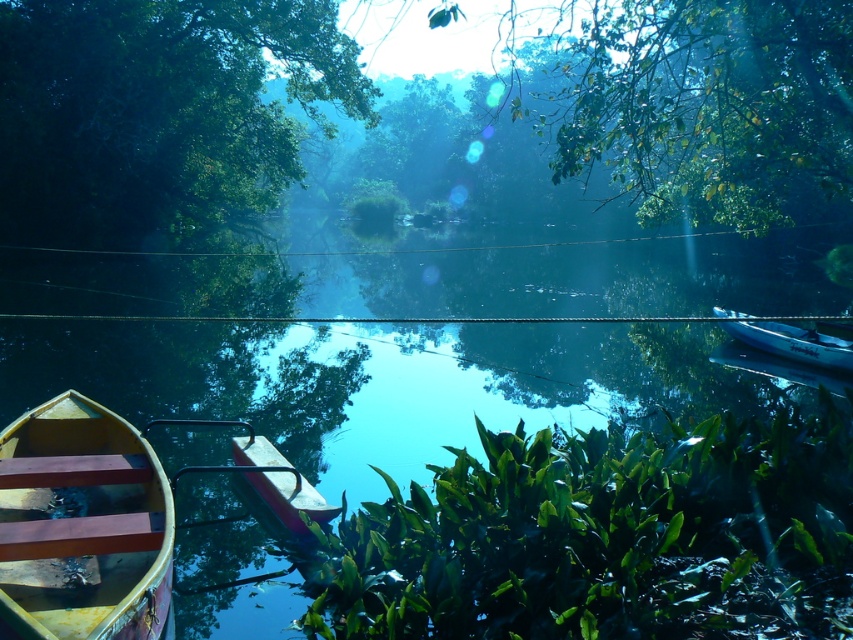
You are an observer looking at the scene. Which object takes up more space in the image, the transparent glass river at center or the green leafy tree at upper left?

The transparent glass river at center takes up more space in the image than the green leafy tree at upper left because it is bigger.

You are standing on the wooden boat and want to place both the green leafy plant at center and the green leafy tree at upper center on the boat. Which object will require more space horizontally?

The green leafy tree at upper center requires more horizontal space because it has a greater width than the green leafy plant at center.